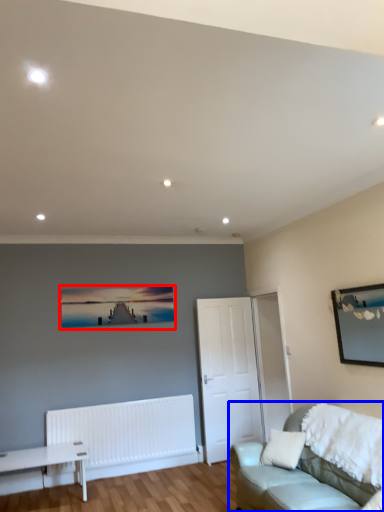
Question: Which object appears closest to the camera in this image, picture frame (highlighted by a red box) or studio couch (highlighted by a blue box)?

Choices:
 (A) picture frame
 (B) studio couch

Answer: (B)